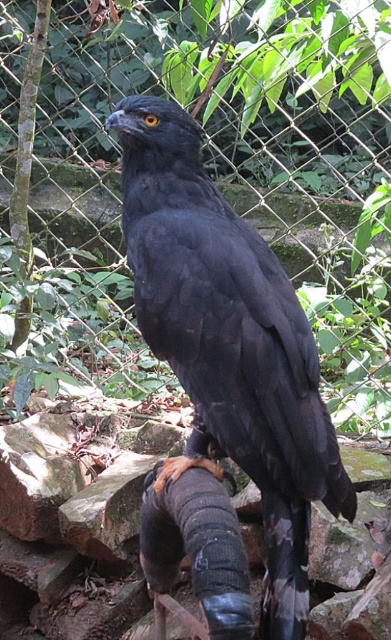
Question: Can you confirm if wire mesh fence at center is bigger than black matte/furred falcon at center?

Choices:
 (A) yes
 (B) no

Answer: (A)

Question: Among these points, which one is nearest to the camera?

Choices:
 (A) (127, 8)
 (B) (265, 451)

Answer: (B)

Question: Among these objects, which one is farthest from the camera?

Choices:
 (A) black matte/furred falcon at center
 (B) wire mesh fence at center

Answer: (B)

Question: Is wire mesh fence at center closer to the viewer compared to black matte/furred falcon at center?

Choices:
 (A) yes
 (B) no

Answer: (B)

Question: Does wire mesh fence at center have a smaller size compared to black matte/furred falcon at center?

Choices:
 (A) no
 (B) yes

Answer: (A)

Question: Which object appears closest to the camera in this image?

Choices:
 (A) wire mesh fence at center
 (B) black matte/furred falcon at center

Answer: (B)